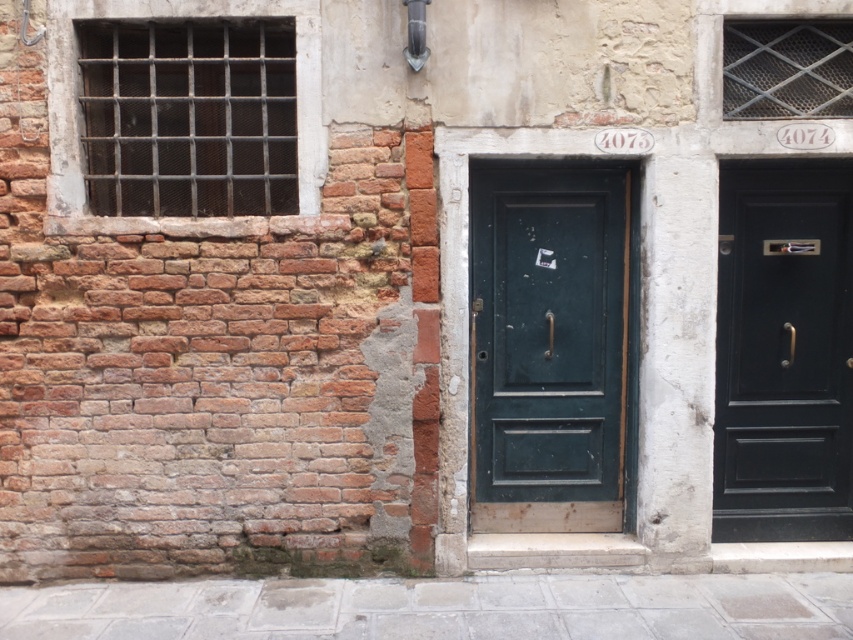
Question: Is dark green wooden door at center smaller than matte black door at center right?

Choices:
 (A) yes
 (B) no

Answer: (A)

Question: Among these objects, which one is nearest to the camera?

Choices:
 (A) dark green wooden door at center
 (B) matte black door at center right

Answer: (A)

Question: Which point is farther from the camera taking this photo?

Choices:
 (A) (801, 474)
 (B) (610, 285)

Answer: (A)

Question: From the image, what is the correct spatial relationship of dark green wooden door at center in relation to matte black door at center right?

Choices:
 (A) below
 (B) above

Answer: (B)

Question: Which point is farther to the camera?

Choices:
 (A) (514, 525)
 (B) (848, 237)

Answer: (A)

Question: Does dark green wooden door at center have a smaller size compared to matte black door at center right?

Choices:
 (A) yes
 (B) no

Answer: (A)